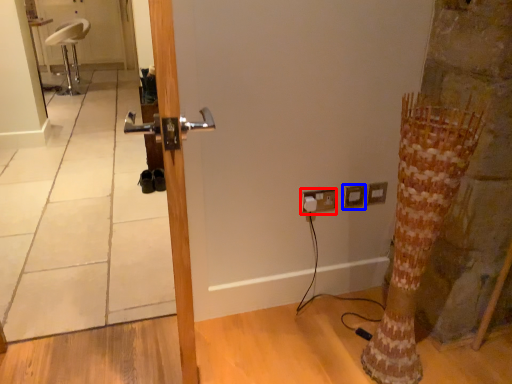
Question: Among these objects, which one is nearest to the camera, electric outlet (highlighted by a red box) or electric outlet (highlighted by a blue box)?

Choices:
 (A) electric outlet
 (B) electric outlet

Answer: (A)